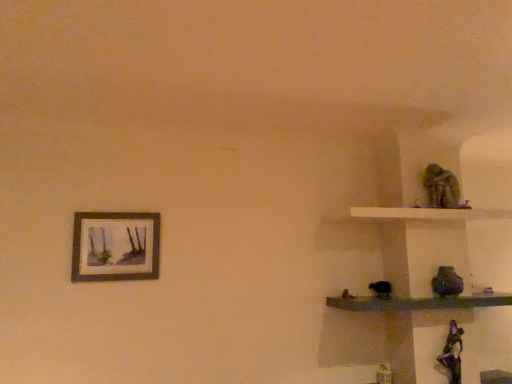
How much space does smooth dark wood shelf at right, placed as the 1th shelf when sorted from bottom to top, occupy horizontally?

smooth dark wood shelf at right, placed as the 1th shelf when sorted from bottom to top, is 16.70 inches in width.

The width and height of the screenshot is (512, 384). What do you see at coordinates (115, 246) in the screenshot? I see `matte wooden picture frame at upper left` at bounding box center [115, 246].

Measure the distance between point (122, 228) and camera.

The depth of point (122, 228) is 2.28 meters.

What is the approximate height of white matte shelf at upper right, which ranks as the second shelf in bottom-to-top order?

white matte shelf at upper right, which ranks as the second shelf in bottom-to-top order, is 3.96 inches in height.

Identify the location of smooth dark wood shelf at right, placed as the 1th shelf when sorted from bottom to top. The image size is (512, 384). (418, 302).

Considering the positions of points (125, 218) and (446, 186), is point (125, 218) closer to camera compared to point (446, 186)?

Yes, it is.

Between matte wooden picture frame at upper left and green mossy statue at upper right, which one appears on the right side from the viewer's perspective?

green mossy statue at upper right.

Who is shorter, matte wooden picture frame at upper left or green mossy statue at upper right?

With less height is green mossy statue at upper right.

How distant is matte wooden picture frame at upper left from green mossy statue at upper right?

A distance of 1.76 meters exists between matte wooden picture frame at upper left and green mossy statue at upper right.

From the picture: Is white matte shelf at upper right, which appears as the 1th shelf when viewed from the top, oriented towards matte wooden picture frame at upper left?

No, white matte shelf at upper right, which appears as the 1th shelf when viewed from the top, is not aimed at matte wooden picture frame at upper left.

Looking at this image, based on their sizes in the image, would you say white matte shelf at upper right, which appears as the 1th shelf when viewed from the top, is bigger or smaller than matte wooden picture frame at upper left?

In the image, white matte shelf at upper right, which appears as the 1th shelf when viewed from the top, appears to be larger than matte wooden picture frame at upper left.

Is white matte shelf at upper right, which appears as the 1th shelf when viewed from the top, not close to matte wooden picture frame at upper left?

white matte shelf at upper right, which appears as the 1th shelf when viewed from the top, is far away from matte wooden picture frame at upper left.

Is white matte shelf at upper right, which appears as the 1th shelf when viewed from the top, inside or outside of matte wooden picture frame at upper left?

white matte shelf at upper right, which appears as the 1th shelf when viewed from the top, cannot be found inside matte wooden picture frame at upper left.

Locate an element on the screen. Image resolution: width=512 pixels, height=384 pixels. statue above the white matte shelf at upper right, which appears as the 1th shelf when viewed from the top (from the image's perspective) is located at coordinates (442, 188).

Is white matte shelf at upper right, which appears as the 1th shelf when viewed from the top, to the left of green mossy statue at upper right from the viewer's perspective?

Yes, white matte shelf at upper right, which appears as the 1th shelf when viewed from the top, is to the left of green mossy statue at upper right.

From a real-world perspective, is white matte shelf at upper right, which appears as the 1th shelf when viewed from the top, on green mossy statue at upper right?

No.

Considering the sizes of white matte shelf at upper right, which appears as the 1th shelf when viewed from the top, and green mossy statue at upper right in the image, is white matte shelf at upper right, which appears as the 1th shelf when viewed from the top, wider or thinner than green mossy statue at upper right?

Considering their sizes, white matte shelf at upper right, which appears as the 1th shelf when viewed from the top, looks broader than green mossy statue at upper right.

Would you say matte wooden picture frame at upper left is inside or outside white matte shelf at upper right, which appears as the 1th shelf when viewed from the top?

matte wooden picture frame at upper left is spatially situated outside white matte shelf at upper right, which appears as the 1th shelf when viewed from the top.

From the image's perspective, between matte wooden picture frame at upper left and white matte shelf at upper right, which ranks as the second shelf in bottom-to-top order, who is located below?

matte wooden picture frame at upper left.

This screenshot has height=384, width=512. Identify the location of picture frame below the white matte shelf at upper right, which ranks as the second shelf in bottom-to-top order (from the image's perspective). (115, 246).

Who is taller, green mossy statue at upper right or smooth dark wood shelf at right, placed as the 1th shelf when sorted from bottom to top?

Standing taller between the two is green mossy statue at upper right.

Is green mossy statue at upper right closer to camera compared to smooth dark wood shelf at right, placed as the 1th shelf when sorted from bottom to top?

No, it is behind smooth dark wood shelf at right, placed as the 1th shelf when sorted from bottom to top.

Between green mossy statue at upper right and smooth dark wood shelf at right, placed as the 1th shelf when sorted from bottom to top, which one appears on the right side from the viewer's perspective?

green mossy statue at upper right.

How distant is green mossy statue at upper right from smooth dark wood shelf at right, placed as the 1th shelf when sorted from bottom to top?

green mossy statue at upper right is 24.67 inches away from smooth dark wood shelf at right, placed as the 1th shelf when sorted from bottom to top.

Considering the relative sizes of green mossy statue at upper right and matte wooden picture frame at upper left in the image provided, is green mossy statue at upper right shorter than matte wooden picture frame at upper left?

Indeed, green mossy statue at upper right has a lesser height compared to matte wooden picture frame at upper left.

What's the angular difference between green mossy statue at upper right and matte wooden picture frame at upper left's facing directions?

The angle between the facing direction of green mossy statue at upper right and the facing direction of matte wooden picture frame at upper left is 0.37 degrees.

From the image's perspective, is green mossy statue at upper right located above or below matte wooden picture frame at upper left?

green mossy statue at upper right is above matte wooden picture frame at upper left.

Is green mossy statue at upper right located outside matte wooden picture frame at upper left?

That's correct, green mossy statue at upper right is outside of matte wooden picture frame at upper left.

You are a GUI agent. You are given a task and a screenshot of the screen. Output one action in this format:
    pyautogui.click(x=<x>, y=<y>)
    Task: Click on the 1st shelf below the green mossy statue at upper right (from the image's perspective)
    The image size is (512, 384).
    Given the screenshot: What is the action you would take?
    pyautogui.click(x=428, y=214)

Can you tell me how much green mossy statue at upper right and white matte shelf at upper right, which appears as the 1th shelf when viewed from the top, differ in facing direction?

The angular difference between green mossy statue at upper right and white matte shelf at upper right, which appears as the 1th shelf when viewed from the top, is 2.17 degrees.

Is green mossy statue at upper right beside white matte shelf at upper right, which ranks as the second shelf in bottom-to-top order?

No, green mossy statue at upper right is not making contact with white matte shelf at upper right, which ranks as the second shelf in bottom-to-top order.

In terms of width, does green mossy statue at upper right look wider or thinner when compared to white matte shelf at upper right, which appears as the 1th shelf when viewed from the top?

Considering their sizes, green mossy statue at upper right looks slimmer than white matte shelf at upper right, which appears as the 1th shelf when viewed from the top.

You are a GUI agent. You are given a task and a screenshot of the screen. Output one action in this format:
    pyautogui.click(x=<x>, y=<y>)
    Task: Click on the picture frame on the left of green mossy statue at upper right
    The width and height of the screenshot is (512, 384).
    Given the screenshot: What is the action you would take?
    pyautogui.click(x=115, y=246)

The width and height of the screenshot is (512, 384). Find the location of `picture frame beneath the white matte shelf at upper right, which appears as the 1th shelf when viewed from the top (from a real-world perspective)`. picture frame beneath the white matte shelf at upper right, which appears as the 1th shelf when viewed from the top (from a real-world perspective) is located at coordinates (115, 246).

When comparing their distances from green mossy statue at upper right, does matte wooden picture frame at upper left or smooth dark wood shelf at right, placed as the 1th shelf when sorted from bottom to top, seem closer?

The object closer to green mossy statue at upper right is smooth dark wood shelf at right, placed as the 1th shelf when sorted from bottom to top.

Looking at the image, which one is located further to white matte shelf at upper right, which ranks as the second shelf in bottom-to-top order, smooth dark wood shelf at right, the second shelf when ordered from top to bottom, or green mossy statue at upper right?

smooth dark wood shelf at right, the second shelf when ordered from top to bottom, lies further to white matte shelf at upper right, which ranks as the second shelf in bottom-to-top order, than the other object.

Considering their positions, is matte wooden picture frame at upper left positioned further to green mossy statue at upper right than white matte shelf at upper right, which appears as the 1th shelf when viewed from the top?

Based on the image, matte wooden picture frame at upper left appears to be further to green mossy statue at upper right.

Based on their spatial positions, is white matte shelf at upper right, which appears as the 1th shelf when viewed from the top, or matte wooden picture frame at upper left closer to smooth dark wood shelf at right, the second shelf when ordered from top to bottom?

Among the two, white matte shelf at upper right, which appears as the 1th shelf when viewed from the top, is located nearer to smooth dark wood shelf at right, the second shelf when ordered from top to bottom.

In the scene shown: Based on their spatial positions, is white matte shelf at upper right, which ranks as the second shelf in bottom-to-top order, or smooth dark wood shelf at right, the second shelf when ordered from top to bottom, further from matte wooden picture frame at upper left?

white matte shelf at upper right, which ranks as the second shelf in bottom-to-top order, is further to matte wooden picture frame at upper left.

Considering their positions, is green mossy statue at upper right positioned closer to matte wooden picture frame at upper left than white matte shelf at upper right, which appears as the 1th shelf when viewed from the top?

Among the two, white matte shelf at upper right, which appears as the 1th shelf when viewed from the top, is located nearer to matte wooden picture frame at upper left.

From the image, which object appears to be nearer to green mossy statue at upper right, white matte shelf at upper right, which ranks as the second shelf in bottom-to-top order, or smooth dark wood shelf at right, the second shelf when ordered from top to bottom?

white matte shelf at upper right, which ranks as the second shelf in bottom-to-top order, lies closer to green mossy statue at upper right than the other object.

Based on their spatial positions, is smooth dark wood shelf at right, the second shelf when ordered from top to bottom, or green mossy statue at upper right further from matte wooden picture frame at upper left?

The object further to matte wooden picture frame at upper left is green mossy statue at upper right.

The width and height of the screenshot is (512, 384). Identify the location of shelf between green mossy statue at upper right and smooth dark wood shelf at right, the second shelf when ordered from top to bottom, from top to bottom. (428, 214).

Where is `shelf between matte wooden picture frame at upper left and smooth dark wood shelf at right, placed as the 1th shelf when sorted from bottom to top`? shelf between matte wooden picture frame at upper left and smooth dark wood shelf at right, placed as the 1th shelf when sorted from bottom to top is located at coordinates (428, 214).